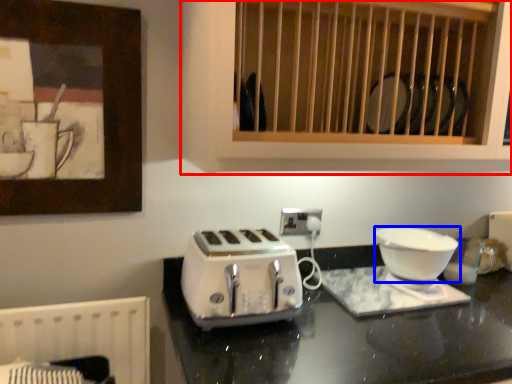
Question: Among these objects, which one is farthest to the camera, cabinetry (highlighted by a red box) or kitchen appliance (highlighted by a blue box)?

Choices:
 (A) cabinetry
 (B) kitchen appliance

Answer: (B)